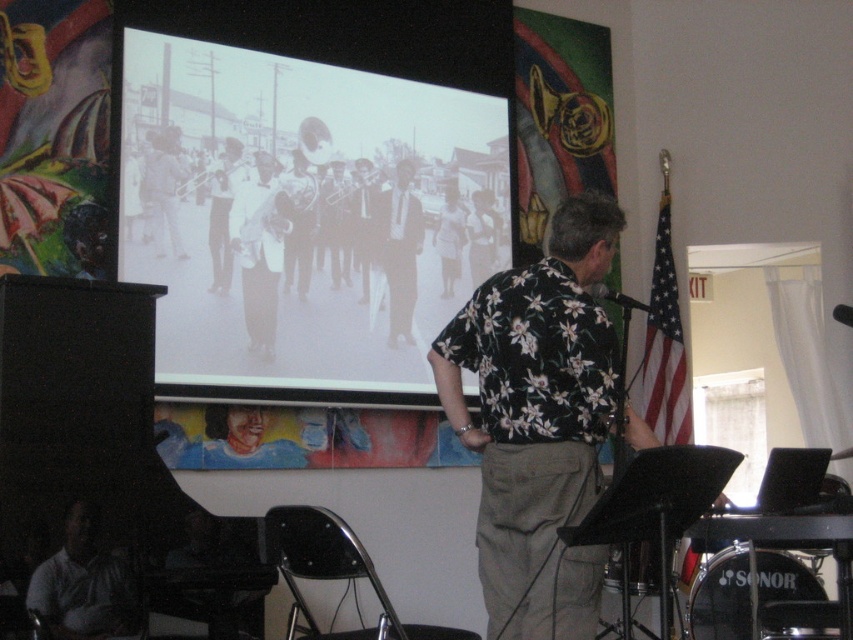
Which of these two, khaki pants at center or dark suit at center, stands taller?

khaki pants at center

Looking at this image, who is positioned more to the right, khaki pants at center or dark suit at center?

khaki pants at center is more to the right.

Where is `khaki pants at center`? Image resolution: width=853 pixels, height=640 pixels. khaki pants at center is located at coordinates (538, 420).

Does black matte projection screen at upper center lie behind khaki pants at center?

Yes, black matte projection screen at upper center is behind khaki pants at center.

Can you confirm if black matte projection screen at upper center is positioned to the right of khaki pants at center?

Incorrect, black matte projection screen at upper center is not on the right side of khaki pants at center.

The width and height of the screenshot is (853, 640). Identify the location of black matte projection screen at upper center. (300, 212).

Is point (80, 536) closer to camera compared to point (347, 256)?

Yes, it is in front of point (347, 256).

Consider the image. Is light brown leather jacket at lower left taller than matte black trombone at center?

In fact, light brown leather jacket at lower left may be shorter than matte black trombone at center.

Based on the photo, who is more distant from viewer, (112, 592) or (332, 166)?

Positioned behind is point (332, 166).

You are a GUI agent. You are given a task and a screenshot of the screen. Output one action in this format:
    pyautogui.click(x=<x>, y=<y>)
    Task: Click on the light brown leather jacket at lower left
    The width and height of the screenshot is (853, 640).
    Given the screenshot: What is the action you would take?
    pyautogui.click(x=82, y=584)